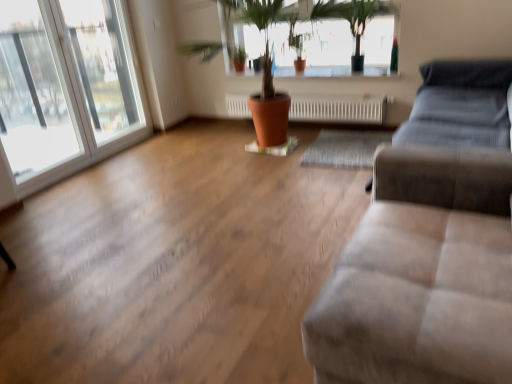
This screenshot has height=384, width=512. What do you see at coordinates (103, 67) in the screenshot? I see `transparent glass window at left, placed as the first window when sorted from right to left` at bounding box center [103, 67].

Describe the element at coordinates (338, 108) in the screenshot. This screenshot has width=512, height=384. I see `white textured radiator at center` at that location.

Consider the image. In order to face green leafy plant at upper center, should I rotate leftwards or rightwards?

It's best to rotate right around 6.746 degrees.

Describe the element at coordinates (298, 64) in the screenshot. I see `terracotta clay pot at center` at that location.

I want to click on terracotta clay pot at center, so click(x=298, y=64).

What do you see at coordinates (422, 275) in the screenshot? I see `suede-like beige couch at lower right` at bounding box center [422, 275].

The width and height of the screenshot is (512, 384). Identify the location of transparent glass window at left, placed as the first window when sorted from right to left. (103, 67).

Is white textured radiator at center spatially inside terracotta clay pot at center, or outside of it?

white textured radiator at center cannot be found inside terracotta clay pot at center.

Could you tell me if white textured radiator at center is facing terracotta clay pot at center?

No, white textured radiator at center does not turn towards terracotta clay pot at center.

Is white textured radiator at center at the right side of terracotta clay pot at center?

Correct, you'll find white textured radiator at center to the right of terracotta clay pot at center.

Who is bigger, white textured radiator at center or terracotta clay pot at center?

white textured radiator at center.

Which object is wider, transparent glass window at left, the 2th window viewed from the right, or transparent glass window at left, positioned as the second window in left-to-right order?

Wider between the two is transparent glass window at left, the 2th window viewed from the right.

Is transparent glass window at left, arranged as the 1th window when viewed from the left, touching transparent glass window at left, positioned as the second window in left-to-right order?

Yes, transparent glass window at left, arranged as the 1th window when viewed from the left, is next to transparent glass window at left, positioned as the second window in left-to-right order.

Consider the image. Can you confirm if transparent glass window at left, arranged as the 1th window when viewed from the left, is taller than transparent glass window at left, placed as the first window when sorted from right to left?

Indeed, transparent glass window at left, arranged as the 1th window when viewed from the left, has a greater height compared to transparent glass window at left, placed as the first window when sorted from right to left.

Which object is closer to the camera taking this photo, transparent glass window at left, the 2th window viewed from the right, or transparent glass window at left, placed as the first window when sorted from right to left?

transparent glass window at left, the 2th window viewed from the right, is more forward.

Are white textured radiator at center and green leafy plant at upper center located far from each other?

That's not correct — white textured radiator at center is a little close to green leafy plant at upper center.

How distant is white textured radiator at center from green leafy plant at upper center?

white textured radiator at center and green leafy plant at upper center are 19.78 inches apart.

You are a GUI agent. You are given a task and a screenshot of the screen. Output one action in this format:
    pyautogui.click(x=<x>, y=<y>)
    Task: Click on the radiator behind the green leafy plant at upper center
    This screenshot has width=512, height=384.
    Given the screenshot: What is the action you would take?
    pyautogui.click(x=338, y=108)

Which object is more forward, white textured radiator at center or green leafy plant at upper center?

green leafy plant at upper center is in front.

Is point (124, 45) positioned behind point (429, 262)?

Yes.

From the image's perspective, between transparent glass window at left, the 2th window viewed from the right, and suede-like beige couch at lower right, who is located below?

suede-like beige couch at lower right, from the image's perspective.

Is transparent glass window at left, arranged as the 1th window when viewed from the left, oriented away from suede-like beige couch at lower right?

transparent glass window at left, arranged as the 1th window when viewed from the left, does not have its back to suede-like beige couch at lower right.

This screenshot has width=512, height=384. I want to click on the 1st window behind when counting from the suede-like beige couch at lower right, so click(x=91, y=91).

Considering the positions of objects suede-like beige couch at lower right and terracotta clay pot at center in the image provided, who is more to the left, suede-like beige couch at lower right or terracotta clay pot at center?

Positioned to the left is terracotta clay pot at center.

From the image's perspective, does suede-like beige couch at lower right appear lower than terracotta clay pot at center?

Correct, suede-like beige couch at lower right appears lower than terracotta clay pot at center in the image.

In the image, there is a terracotta clay pot at center. In order to click on studio couch below it (from a real-world perspective) in this screenshot , I will do `click(422, 275)`.

Looking at the image, does suede-like beige couch at lower right seem bigger or smaller compared to terracotta clay pot at center?

suede-like beige couch at lower right is bigger than terracotta clay pot at center.

Does suede-like beige couch at lower right have a lesser height compared to transparent glass window at left, placed as the first window when sorted from right to left?

Indeed, suede-like beige couch at lower right has a lesser height compared to transparent glass window at left, placed as the first window when sorted from right to left.

Is suede-like beige couch at lower right not within transparent glass window at left, placed as the first window when sorted from right to left?

Absolutely, suede-like beige couch at lower right is external to transparent glass window at left, placed as the first window when sorted from right to left.

Find the location of `studio couch below the transparent glass window at left, placed as the first window when sorted from right to left (from a real-world perspective)`. studio couch below the transparent glass window at left, placed as the first window when sorted from right to left (from a real-world perspective) is located at coordinates (422, 275).

Is suede-like beige couch at lower right looking in the opposite direction of transparent glass window at left, placed as the first window when sorted from right to left?

No, suede-like beige couch at lower right is not facing away from transparent glass window at left, placed as the first window when sorted from right to left.

From the image's perspective, is white textured radiator at center above or below transparent glass window at left, placed as the first window when sorted from right to left?

white textured radiator at center is situated lower than transparent glass window at left, placed as the first window when sorted from right to left, in the image.

How different are the orientations of white textured radiator at center and transparent glass window at left, placed as the first window when sorted from right to left, in degrees?

The angular difference between white textured radiator at center and transparent glass window at left, placed as the first window when sorted from right to left, is 92.3 degrees.

Is white textured radiator at center positioned beyond the bounds of transparent glass window at left, placed as the first window when sorted from right to left?

Indeed, white textured radiator at center is completely outside transparent glass window at left, placed as the first window when sorted from right to left.

Based on their positions, is white textured radiator at center located to the left or right of transparent glass window at left, positioned as the second window in left-to-right order?

In the image, white textured radiator at center appears on the right side of transparent glass window at left, positioned as the second window in left-to-right order.

Locate an element on the screen. radiator that is below the terracotta clay pot at center (from the image's perspective) is located at coordinates (338, 108).

Where is `window that appears above the transparent glass window at left, arranged as the 1th window when viewed from the left (from the image's perspective)`? window that appears above the transparent glass window at left, arranged as the 1th window when viewed from the left (from the image's perspective) is located at coordinates (103, 67).

Based on their spatial positions, is white textured radiator at center or transparent glass window at left, the 2th window viewed from the right, closer to green leafy plant at upper center?

Based on the image, white textured radiator at center appears to be nearer to green leafy plant at upper center.

Estimate the real-world distances between objects in this image. Which object is closer to transparent glass window at left, arranged as the 1th window when viewed from the left, green leafy plant at upper center or suede-like beige couch at lower right?

Based on the image, green leafy plant at upper center appears to be nearer to transparent glass window at left, arranged as the 1th window when viewed from the left.

Looking at the image, which one is located further to suede-like beige couch at lower right, green leafy plant at upper center or transparent glass window at left, the 2th window viewed from the right?

Among the two, transparent glass window at left, the 2th window viewed from the right, is located further to suede-like beige couch at lower right.

Consider the image. Considering their positions, is suede-like beige couch at lower right positioned further to transparent glass window at left, positioned as the second window in left-to-right order, than transparent glass window at left, arranged as the 1th window when viewed from the left?

Based on the image, suede-like beige couch at lower right appears to be further to transparent glass window at left, positioned as the second window in left-to-right order.

Looking at the image, which one is located further to white textured radiator at center, suede-like beige couch at lower right or green leafy plant at upper center?

suede-like beige couch at lower right is further to white textured radiator at center.

Considering their positions, is suede-like beige couch at lower right positioned further to green leafy plant at upper center than transparent glass window at left, placed as the first window when sorted from right to left?

suede-like beige couch at lower right is positioned further to the anchor green leafy plant at upper center.

Looking at the image, which one is located closer to white textured radiator at center, transparent glass window at left, arranged as the 1th window when viewed from the left, or transparent glass window at left, placed as the first window when sorted from right to left?

transparent glass window at left, placed as the first window when sorted from right to left.

Considering their positions, is transparent glass window at left, arranged as the 1th window when viewed from the left, positioned closer to green leafy plant at upper center than transparent glass window at left, positioned as the second window in left-to-right order?

transparent glass window at left, positioned as the second window in left-to-right order, is positioned closer to the anchor green leafy plant at upper center.

The height and width of the screenshot is (384, 512). Find the location of `flowerpot located between transparent glass window at left, the 2th window viewed from the right, and white textured radiator at center in the left-right direction`. flowerpot located between transparent glass window at left, the 2th window viewed from the right, and white textured radiator at center in the left-right direction is located at coordinates (298, 64).

This screenshot has width=512, height=384. I want to click on flowerpot situated between transparent glass window at left, the 2th window viewed from the right, and green leafy plant at upper center from left to right, so tap(298, 64).

The width and height of the screenshot is (512, 384). Find the location of `bay window between suede-like beige couch at lower right and terracotta clay pot at center from front to back`. bay window between suede-like beige couch at lower right and terracotta clay pot at center from front to back is located at coordinates (313, 38).

At what (x,y) coordinates should I click in order to perform the action: click on radiator between transparent glass window at left, positioned as the second window in left-to-right order, and green leafy plant at upper center. Please return your answer as a coordinate pair (x, y). Looking at the image, I should click on (338, 108).